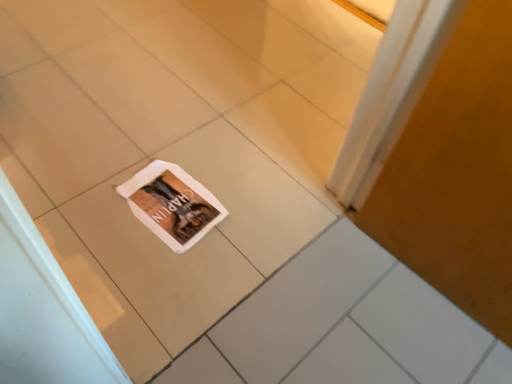
Locate an element on the screen. This screenshot has width=512, height=384. vacant space that is to the left of white paper postcard at center is located at coordinates (91, 188).